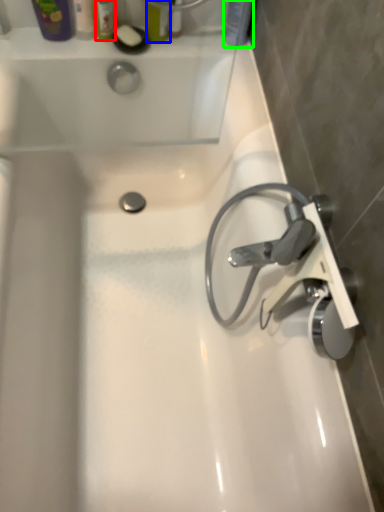
Question: Based on their relative distances, which object is farther from toiletry (highlighted by a red box)? Choose from toiletry (highlighted by a blue box) and toiletry (highlighted by a green box).

Choices:
 (A) toiletry
 (B) toiletry

Answer: (B)